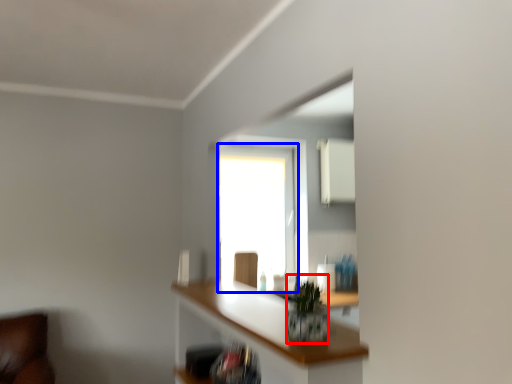
Question: Which point is closer to the camera, plant (highlighted by a red box) or window (highlighted by a blue box)?

Choices:
 (A) plant
 (B) window

Answer: (A)